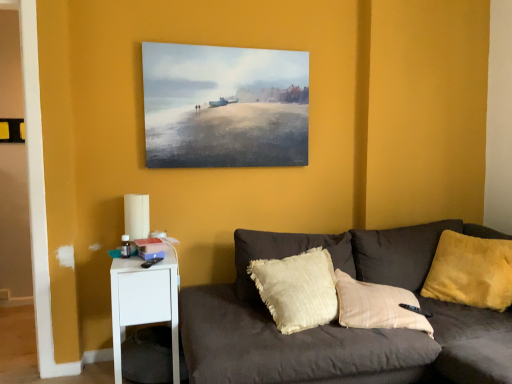
Question: Is white paper lampshade at left closer to the viewer compared to yellow plush pillow at right?

Choices:
 (A) yes
 (B) no

Answer: (B)

Question: From the image's perspective, does white paper lampshade at left appear higher than yellow plush pillow at right?

Choices:
 (A) no
 (B) yes

Answer: (B)

Question: Is white paper lampshade at left oriented away from yellow plush pillow at right?

Choices:
 (A) no
 (B) yes

Answer: (A)

Question: Does white paper lampshade at left have a smaller size compared to yellow plush pillow at right?

Choices:
 (A) yes
 (B) no

Answer: (A)

Question: From the image's perspective, is white paper lampshade at left located beneath yellow plush pillow at right?

Choices:
 (A) yes
 (B) no

Answer: (B)

Question: Are white paper lampshade at left and yellow plush pillow at right located far from each other?

Choices:
 (A) no
 (B) yes

Answer: (B)

Question: Considering the relative sizes of white plastic nightstand at lower left and watercolor painting at upper center in the image provided, is white plastic nightstand at lower left thinner than watercolor painting at upper center?

Choices:
 (A) no
 (B) yes

Answer: (A)

Question: Does white plastic nightstand at lower left have a lesser height compared to watercolor painting at upper center?

Choices:
 (A) yes
 (B) no

Answer: (A)

Question: From a real-world perspective, is white plastic nightstand at lower left physically above watercolor painting at upper center?

Choices:
 (A) no
 (B) yes

Answer: (A)

Question: Can we say white plastic nightstand at lower left lies outside watercolor painting at upper center?

Choices:
 (A) yes
 (B) no

Answer: (A)

Question: Is white plastic nightstand at lower left surrounding watercolor painting at upper center?

Choices:
 (A) yes
 (B) no

Answer: (B)

Question: Can you confirm if white plastic nightstand at lower left is wider than watercolor painting at upper center?

Choices:
 (A) yes
 (B) no

Answer: (A)

Question: Can you confirm if white plastic nightstand at lower left is shorter than white paper lampshade at left?

Choices:
 (A) no
 (B) yes

Answer: (A)